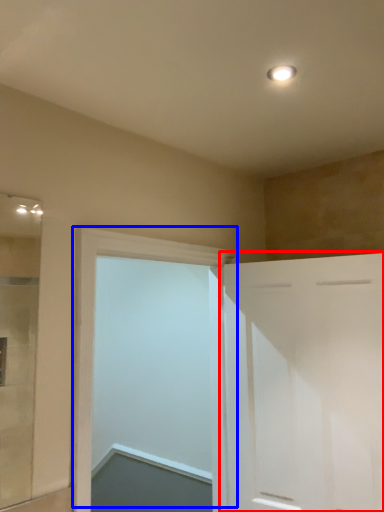
Question: Which of the following is the farthest to the observer, door (highlighted by a red box) or door (highlighted by a blue box)?

Choices:
 (A) door
 (B) door

Answer: (A)